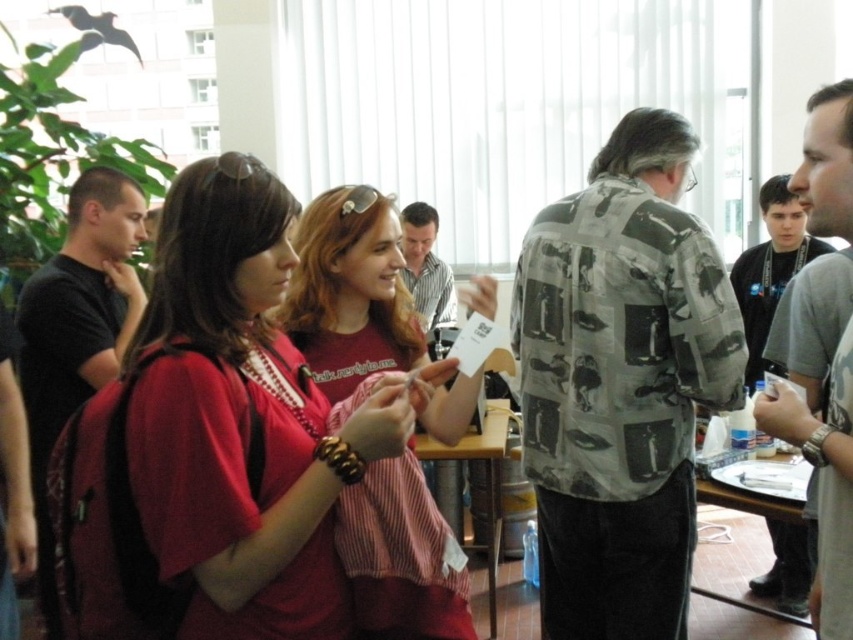
Question: Considering the relative positions of printed camouflage shirt at center and gray printed shirt at center in the image provided, where is printed camouflage shirt at center located with respect to gray printed shirt at center?

Choices:
 (A) below
 (B) above

Answer: (A)

Question: Can you confirm if black matte shirt at left is positioned below gray printed shirt at center?

Choices:
 (A) no
 (B) yes

Answer: (A)

Question: Which of the following is the closest to the observer?

Choices:
 (A) (107, 339)
 (B) (422, 216)

Answer: (A)

Question: Can you confirm if pink striped shirt at center is positioned below gray printed shirt at center?

Choices:
 (A) no
 (B) yes

Answer: (A)

Question: Which object is closer to the camera taking this photo?

Choices:
 (A) gray printed shirt at center
 (B) pink striped shirt at center
 (C) printed camouflage shirt at center
 (D) matte red shirt at center

Answer: (D)

Question: Considering the real-world distances, which object is closest to the printed camouflage shirt at center?

Choices:
 (A) light brown striped shirt at center
 (B) gray printed shirt at center
 (C) matte red shirt at center
 (D) black matte shirt at left

Answer: (B)